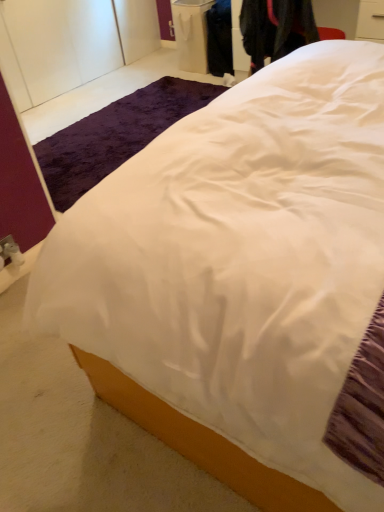
This screenshot has width=384, height=512. What are the coordinates of `purple plush rug at upper left` in the screenshot? It's located at (115, 135).

Based on the photo, measure the distance between purple plush rug at upper left and camera.

The depth of purple plush rug at upper left is 2.06 meters.

What is the approximate width of purple plush rug at upper left?

The width of purple plush rug at upper left is 30.85 inches.

This screenshot has width=384, height=512. What do you see at coordinates (115, 135) in the screenshot?
I see `purple plush rug at upper left` at bounding box center [115, 135].

This screenshot has height=512, width=384. What are the coordinates of `purple plush rug at upper left` in the screenshot? It's located at (x=115, y=135).